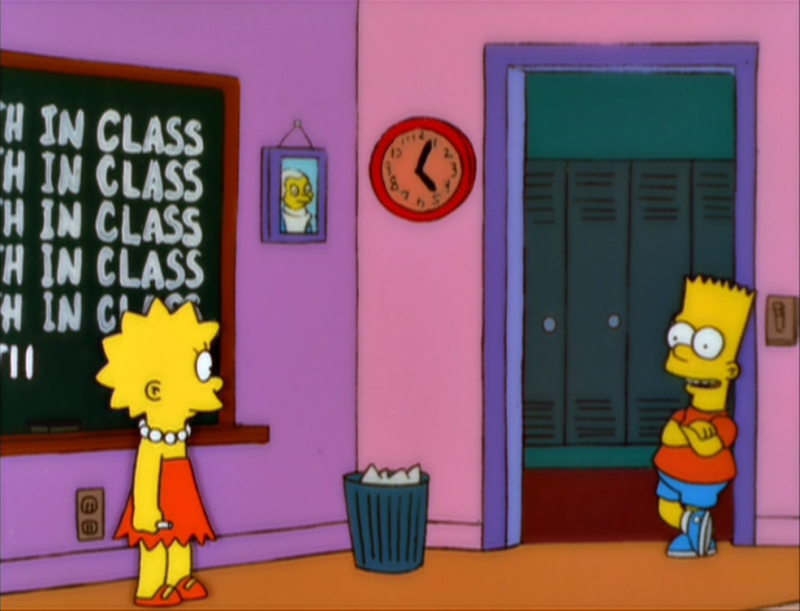
You are a GUI agent. You are given a task and a screenshot of the screen. Output one action in this format:
    pyautogui.click(x=<x>, y=<y>)
    Task: Click on the board
    
    Given the screenshot: What is the action you would take?
    pyautogui.click(x=49, y=386)